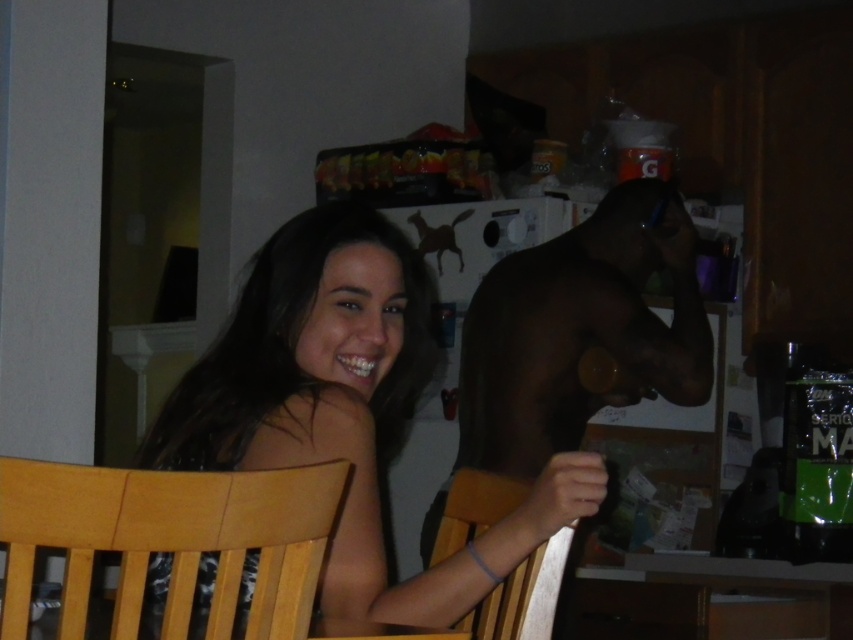
Which is below, wooden chair at lower left or wooden chair at lower center?

Positioned lower is wooden chair at lower center.

Does wooden chair at lower left have a greater height compared to wooden chair at lower center?

No, wooden chair at lower left is not taller than wooden chair at lower center.

Does point (286, 593) come behind point (532, 554)?

No, it is in front of (532, 554).

The width and height of the screenshot is (853, 640). Find the location of `wooden chair at lower left`. wooden chair at lower left is located at coordinates (169, 540).

Is shiny brown torso at center thinner than wooden chair at lower center?

In fact, shiny brown torso at center might be wider than wooden chair at lower center.

In the scene shown: Who is higher up, shiny brown torso at center or wooden chair at lower center?

shiny brown torso at center is above.

Identify the location of shiny brown torso at center. (579, 332).

Is smooth skin girl at center to the right of shiny brown torso at center from the viewer's perspective?

Incorrect, smooth skin girl at center is not on the right side of shiny brown torso at center.

Is smooth skin girl at center positioned at the back of shiny brown torso at center?

No, it is not.

The height and width of the screenshot is (640, 853). What do you see at coordinates (347, 408) in the screenshot?
I see `smooth skin girl at center` at bounding box center [347, 408].

Locate an element on the screen. This screenshot has height=640, width=853. smooth skin girl at center is located at coordinates (347, 408).